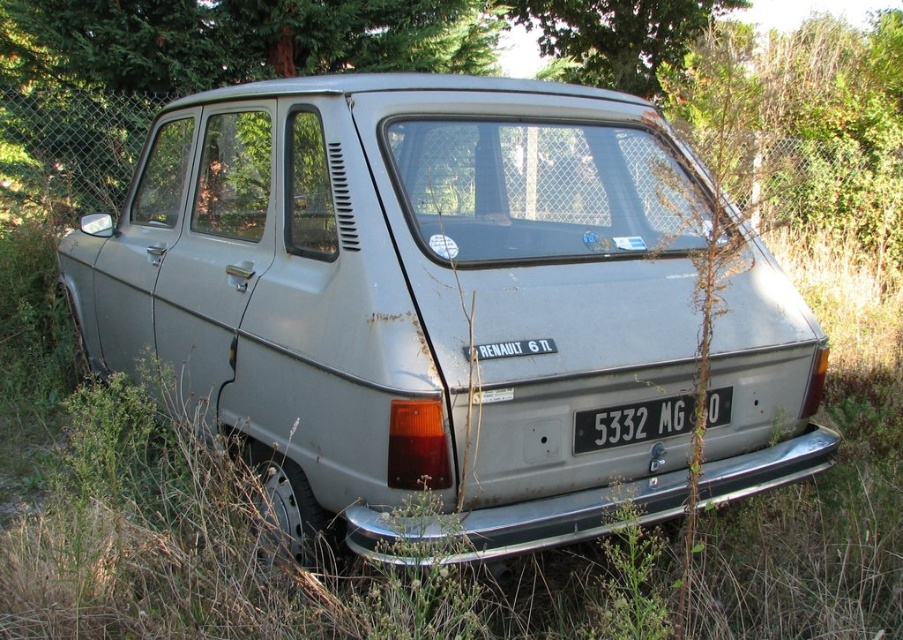
Question: Which point appears farthest from the camera in this image?

Choices:
 (A) tap(497, 369)
 (B) tap(617, 412)

Answer: (B)

Question: Is matte silver car at center above white plastic license plate at center?

Choices:
 (A) no
 (B) yes

Answer: (B)

Question: Can you confirm if matte silver car at center is thinner than white plastic license plate at center?

Choices:
 (A) no
 (B) yes

Answer: (A)

Question: Among these objects, which one is nearest to the camera?

Choices:
 (A) white plastic license plate at center
 (B) matte silver car at center

Answer: (B)

Question: Which of the following is the closest to the observer?

Choices:
 (A) (300, 260)
 (B) (669, 408)

Answer: (B)

Question: Is matte silver car at center to the right of white plastic license plate at center from the viewer's perspective?

Choices:
 (A) yes
 (B) no

Answer: (B)